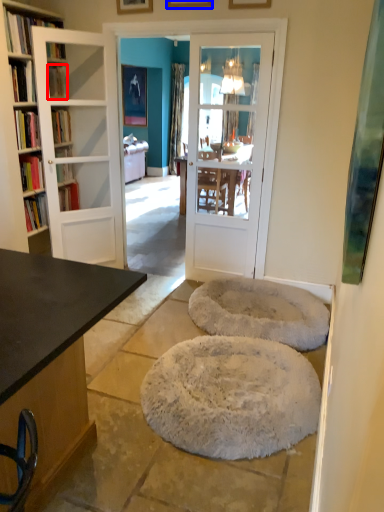
Question: Which object is further to the camera taking this photo, book (highlighted by a red box) or picture frame (highlighted by a blue box)?

Choices:
 (A) book
 (B) picture frame

Answer: (A)